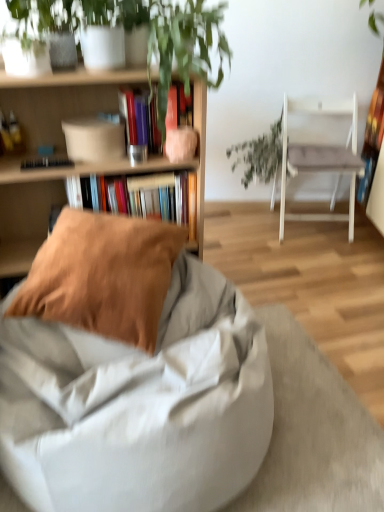
Question: Which is correct: light gray fabric bean bag at center, the 1th chair positioned from the bottom, is inside hardcover book at center, which is counted as the 1th book, starting from the top, or outside of it?

Choices:
 (A) outside
 (B) inside

Answer: (A)

Question: Visually, is light gray fabric bean bag at center, the 1th chair positioned from the bottom, positioned to the left or to the right of hardcover book at center, positioned as the 2th book in bottom-to-top order?

Choices:
 (A) left
 (B) right

Answer: (A)

Question: Which of these objects is positioned closest to the hardcover books at center, marked as the 2th book in a top-to-bottom arrangement?

Choices:
 (A) white fabric chair at right, acting as the first chair starting from the top
 (B) green leafy plant at center
 (C) hardcover book at center, which is counted as the 1th book, starting from the top
 (D) wooden bookshelf at upper left
 (E) brown cotton pillow at center

Answer: (D)

Question: Considering the real-world distances, which object is farthest from the light gray fabric bean bag at center, which appears as the second chair when viewed from the right?

Choices:
 (A) green leafy plant at center
 (B) hardcover book at center, positioned as the 2th book in bottom-to-top order
 (C) wooden bookshelf at upper left
 (D) hardcover books at center, marked as the 2th book in a top-to-bottom arrangement
 (E) brown cotton pillow at center

Answer: (A)